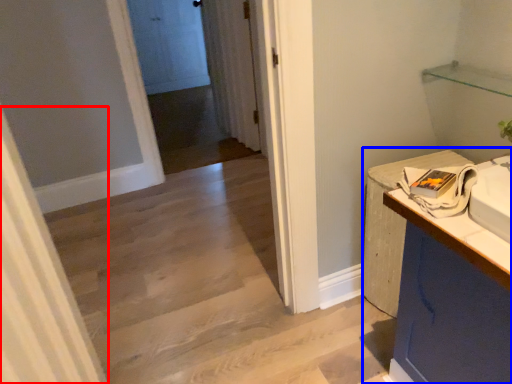
Question: Among these objects, which one is nearest to the camera, curtain (highlighted by a red box) or counter (highlighted by a blue box)?

Choices:
 (A) curtain
 (B) counter

Answer: (A)